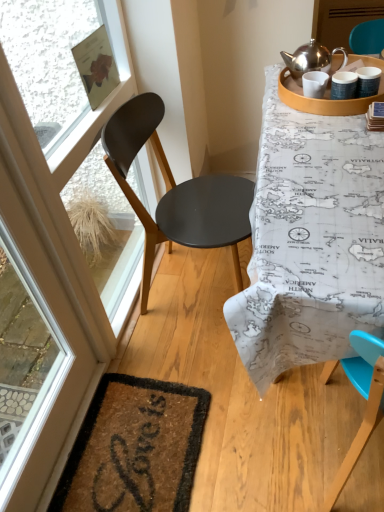
In order to click on free space above brown coir mat at lower left (from a real-world perspective) in this screenshot , I will do `click(129, 450)`.